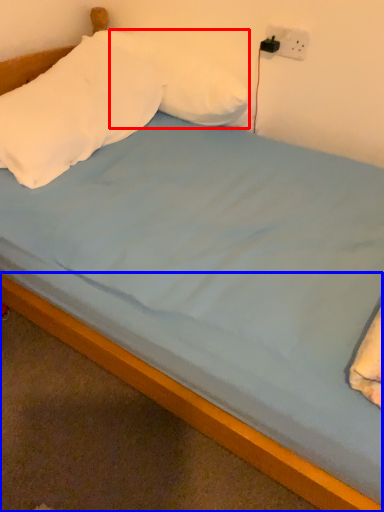
Question: Which object appears closest to the camera in this image, pillow (highlighted by a red box) or bed frame (highlighted by a blue box)?

Choices:
 (A) pillow
 (B) bed frame

Answer: (B)